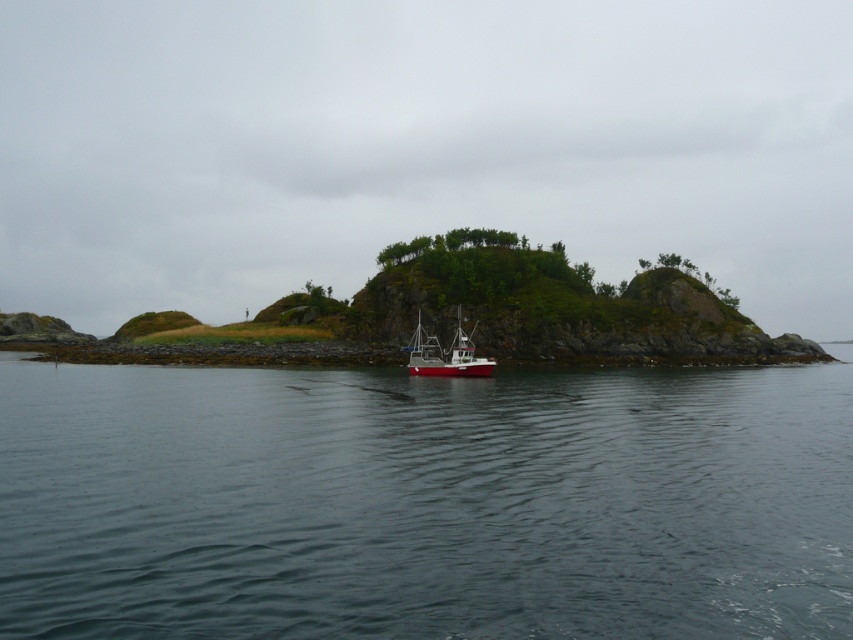
Question: Among these objects, which one is farthest from the camera?

Choices:
 (A) clear water at center
 (B) red matte boat at center

Answer: (B)

Question: Considering the relative positions of clear water at center and red matte boat at center in the image provided, where is clear water at center located with respect to red matte boat at center?

Choices:
 (A) above
 (B) below

Answer: (B)

Question: Considering the relative positions of clear water at center and red matte boat at center in the image provided, where is clear water at center located with respect to red matte boat at center?

Choices:
 (A) right
 (B) left

Answer: (B)

Question: Which point is farther to the camera?

Choices:
 (A) clear water at center
 (B) red matte boat at center

Answer: (B)

Question: Among these objects, which one is farthest from the camera?

Choices:
 (A) red matte boat at center
 (B) clear water at center

Answer: (A)

Question: Is clear water at center thinner than red matte boat at center?

Choices:
 (A) yes
 (B) no

Answer: (B)